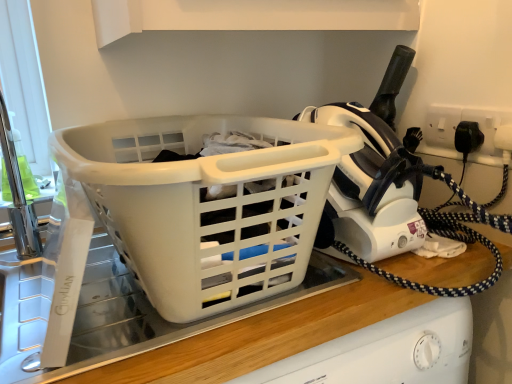
Question: Does white plastic basket at center come in front of white plastic socket at upper right?

Choices:
 (A) no
 (B) yes

Answer: (B)

Question: Is white plastic basket at center beside white plastic socket at upper right?

Choices:
 (A) yes
 (B) no

Answer: (B)

Question: From the image's perspective, does white plastic basket at center appear lower than white plastic socket at upper right?

Choices:
 (A) yes
 (B) no

Answer: (A)

Question: From the image's perspective, is white plastic basket at center located above white plastic socket at upper right?

Choices:
 (A) yes
 (B) no

Answer: (B)

Question: Is white plastic basket at center oriented away from white plastic socket at upper right?

Choices:
 (A) yes
 (B) no

Answer: (B)

Question: Can you confirm if white plastic basket at center is taller than white plastic socket at upper right?

Choices:
 (A) yes
 (B) no

Answer: (A)

Question: Is white plastic iron at upper right outside of white plastic basket at center?

Choices:
 (A) yes
 (B) no

Answer: (A)

Question: Does white plastic iron at upper right have a larger size compared to white plastic basket at center?

Choices:
 (A) yes
 (B) no

Answer: (B)

Question: Could you tell me if white plastic iron at upper right is turned towards white plastic basket at center?

Choices:
 (A) no
 (B) yes

Answer: (A)

Question: Considering the relative sizes of white plastic iron at upper right and white plastic basket at center in the image provided, is white plastic iron at upper right wider than white plastic basket at center?

Choices:
 (A) yes
 (B) no

Answer: (B)

Question: Does white plastic iron at upper right have a lesser width compared to white plastic basket at center?

Choices:
 (A) yes
 (B) no

Answer: (A)

Question: Can you confirm if white plastic iron at upper right is shorter than white plastic basket at center?

Choices:
 (A) yes
 (B) no

Answer: (B)

Question: Is white plastic socket at upper right facing away from white plastic iron at upper right?

Choices:
 (A) no
 (B) yes

Answer: (A)